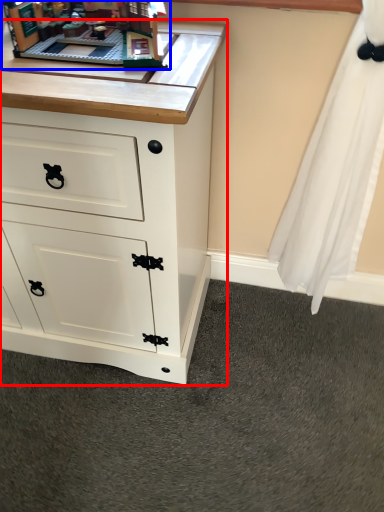
Question: Which object appears farthest to the camera in this image, chest of drawers (highlighted by a red box) or toy (highlighted by a blue box)?

Choices:
 (A) chest of drawers
 (B) toy

Answer: (B)